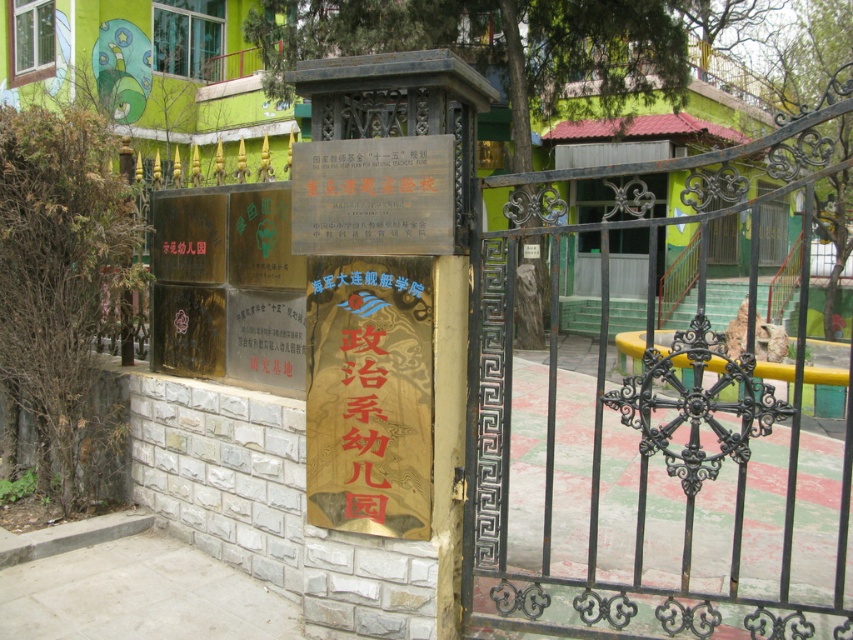
Between black wrought iron gate at center and gold metallic sign at center, which one appears on the right side from the viewer's perspective?

From the viewer's perspective, black wrought iron gate at center appears more on the right side.

Is black wrought iron gate at center taller than gold metallic sign at center?

Yes.

Is point (669, 493) positioned behind point (439, 208)?

That is True.

I want to click on black wrought iron gate at center, so click(664, 422).

Does gold textured sign at center have a larger size compared to gold metallic sign at center?

Correct, gold textured sign at center is larger in size than gold metallic sign at center.

Is gold textured sign at center smaller than gold metallic sign at center?

No.

Image resolution: width=853 pixels, height=640 pixels. What do you see at coordinates (369, 394) in the screenshot? I see `gold textured sign at center` at bounding box center [369, 394].

At what (x,y) coordinates should I click in order to perform the action: click on gold textured sign at center. Please return your answer as a coordinate pair (x, y). The width and height of the screenshot is (853, 640). Looking at the image, I should click on pyautogui.click(x=369, y=394).

Which is in front, point (769, 547) or point (407, 435)?

Point (407, 435)

Identify the location of black wrought iron gate at center. (664, 422).

Locate an element on the screen. The width and height of the screenshot is (853, 640). black wrought iron gate at center is located at coordinates (664, 422).